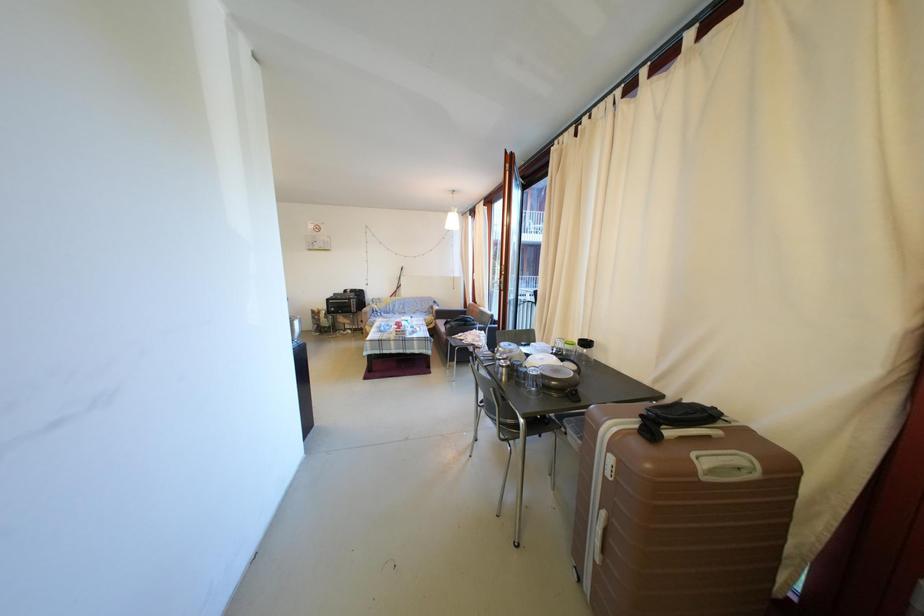
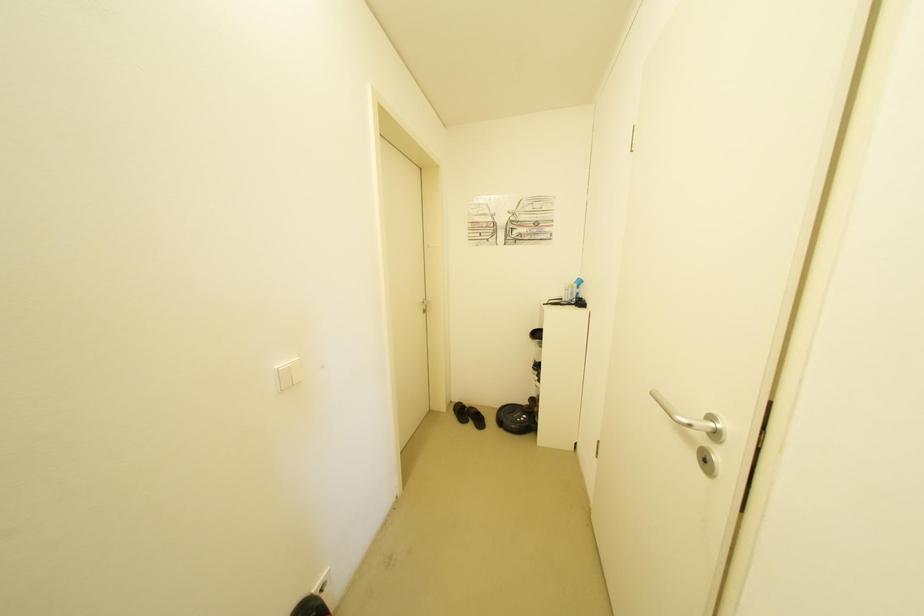
Question: The camera is either moving clockwise (left) or counter-clockwise (right) around the object. The first image is from the beginning of the video and the second image is from the end. Is the camera moving left or right when shooting the video?

Choices:
 (A) Left
 (B) Right

Answer: (B)